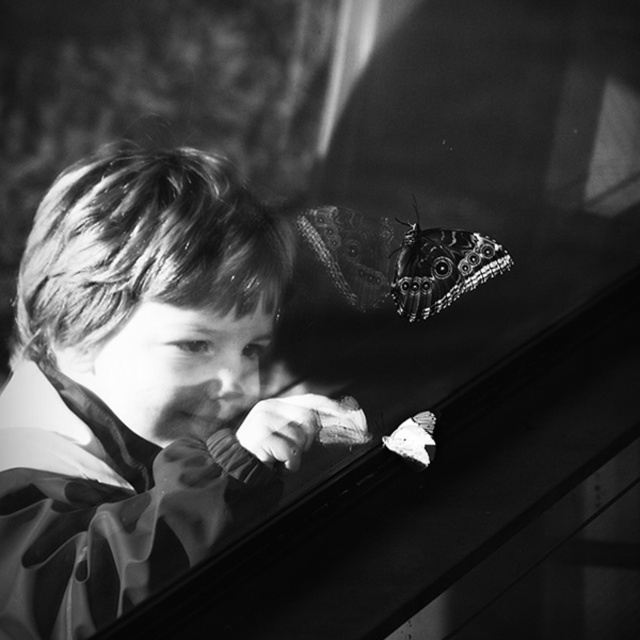
Question: Is patterned wing butterfly at upper right thinner than white matte butterfly at lower right?

Choices:
 (A) no
 (B) yes

Answer: (A)

Question: Considering the relative positions of smooth fabric child at center and patterned wing butterfly at upper right in the image provided, where is smooth fabric child at center located with respect to patterned wing butterfly at upper right?

Choices:
 (A) above
 (B) below

Answer: (B)

Question: Does patterned wing butterfly at upper right appear over white matte butterfly at lower right?

Choices:
 (A) yes
 (B) no

Answer: (A)

Question: Which object appears closest to the camera in this image?

Choices:
 (A) patterned wing butterfly at upper right
 (B) white matte butterfly at lower right
 (C) smooth fabric child at center

Answer: (C)

Question: Estimate the real-world distances between objects in this image. Which object is closer to the patterned wing butterfly at upper right?

Choices:
 (A) smooth fabric child at center
 (B) white matte butterfly at lower right

Answer: (B)

Question: Which of the following is the closest to the observer?

Choices:
 (A) patterned wing butterfly at upper right
 (B) smooth fabric child at center

Answer: (B)